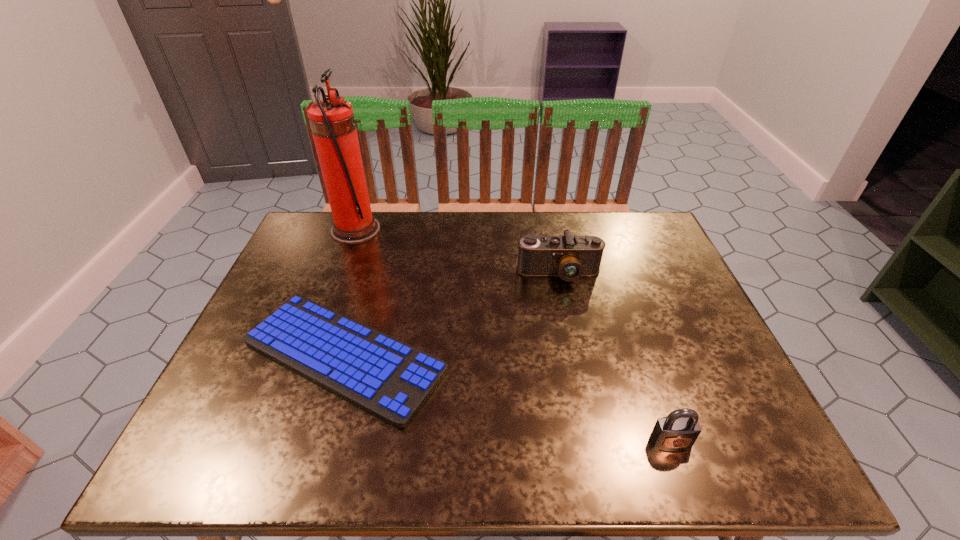
Image resolution: width=960 pixels, height=540 pixels. What are the coordinates of `empty location between the farthest object and the nearest object` in the screenshot? It's located at (514, 335).

At what (x,y) coordinates should I click in order to perform the action: click on free spot between the computer keyboard and the farthest object. Please return your answer as a coordinate pair (x, y). Image resolution: width=960 pixels, height=540 pixels. Looking at the image, I should click on (349, 293).

The width and height of the screenshot is (960, 540). Identify the location of free space that is in between the camera and the padlock. (614, 357).

Where is `vacant space in between the camera and the shortest object`? Image resolution: width=960 pixels, height=540 pixels. vacant space in between the camera and the shortest object is located at coordinates (451, 315).

The width and height of the screenshot is (960, 540). What are the coordinates of `free point between the third nearest object and the nearest object` in the screenshot? It's located at (614, 357).

In order to click on object that is the closest to the fire extinguisher in this screenshot , I will do `click(389, 379)`.

Identify the location of object that stands as the closest to the tallest object. The width and height of the screenshot is (960, 540). (389, 379).

Find the location of a particular element. vacant region that satisfies the following two spatial constraints: 1. at the discharge end of the tallest object; 2. on the left side of the shortest object is located at coordinates (309, 357).

Locate an element on the screen. This screenshot has width=960, height=540. free space that satisfies the following two spatial constraints: 1. at the discharge end of the tallest object; 2. on the right side of the shortest object is located at coordinates (309, 357).